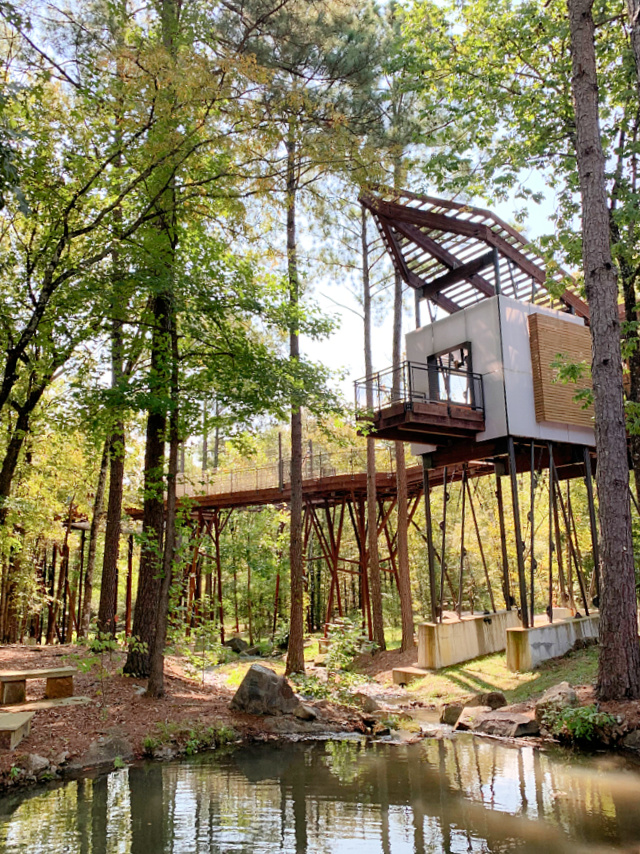
The image size is (640, 854). In order to click on bench in this screenshot , I will do `click(19, 681)`.